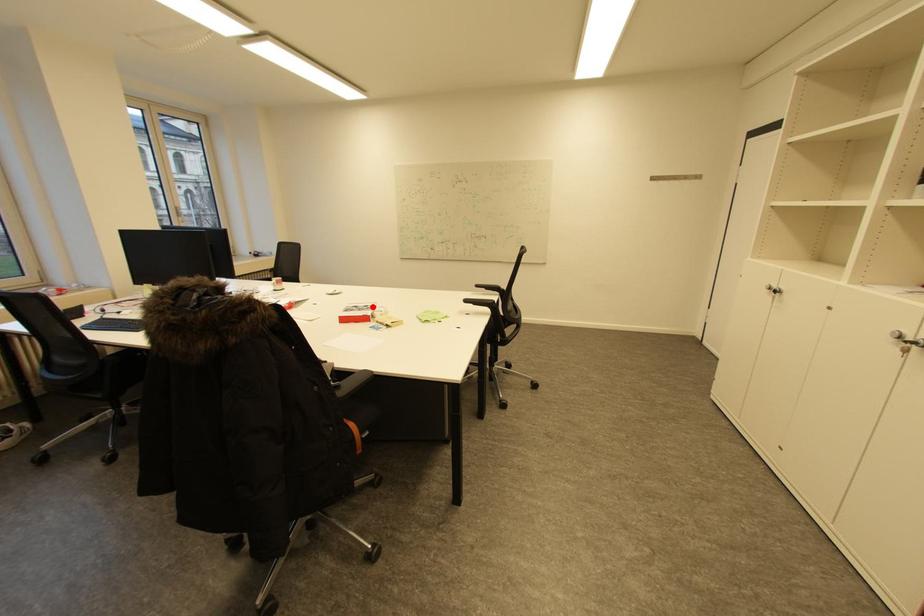
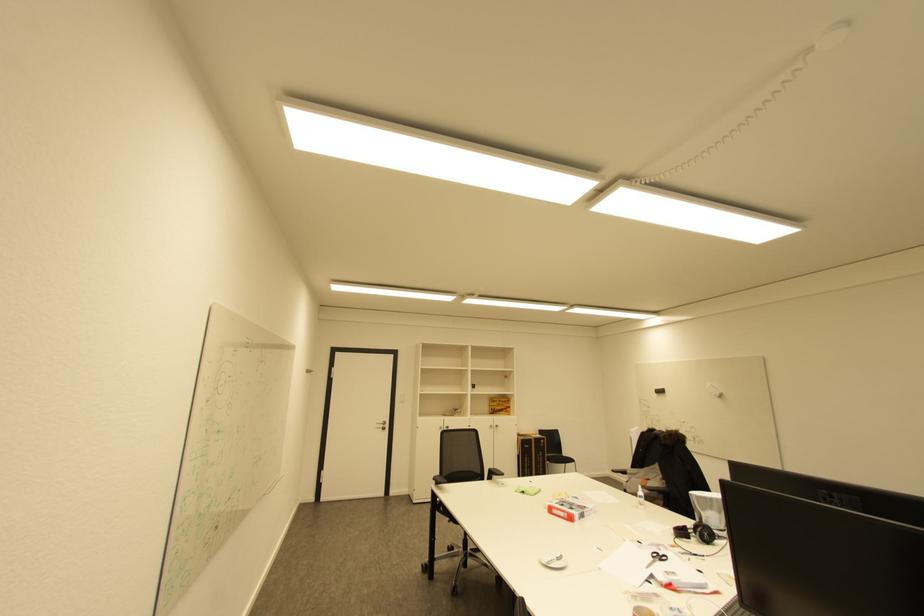
In the second image, find the point that corresponds to the highlighted location in the first image.

(568, 506)